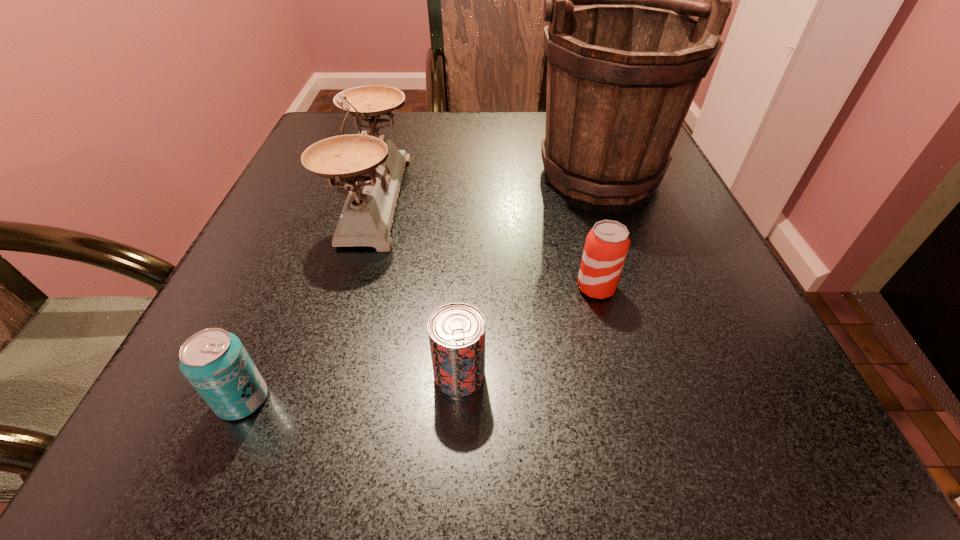
Identify the location of beer can identified as the closest to the second beer can from right to left. (606, 247).

Image resolution: width=960 pixels, height=540 pixels. In order to click on vacant area in the image that satisfies the following two spatial constraints: 1. on the back side of the rightmost beer can; 2. on the front-facing side of the scale in this screenshot , I will do (573, 198).

Where is `free space that satisfies the following two spatial constraints: 1. on the back side of the farthest beer can; 2. on the front-facing side of the second tallest object`? The width and height of the screenshot is (960, 540). free space that satisfies the following two spatial constraints: 1. on the back side of the farthest beer can; 2. on the front-facing side of the second tallest object is located at coordinates (573, 198).

At what (x,y) coordinates should I click in order to perform the action: click on free space that satisfies the following two spatial constraints: 1. on the front-facing side of the scale; 2. on the back side of the third object from left to right. Please return your answer as a coordinate pair (x, y). Looking at the image, I should click on (322, 375).